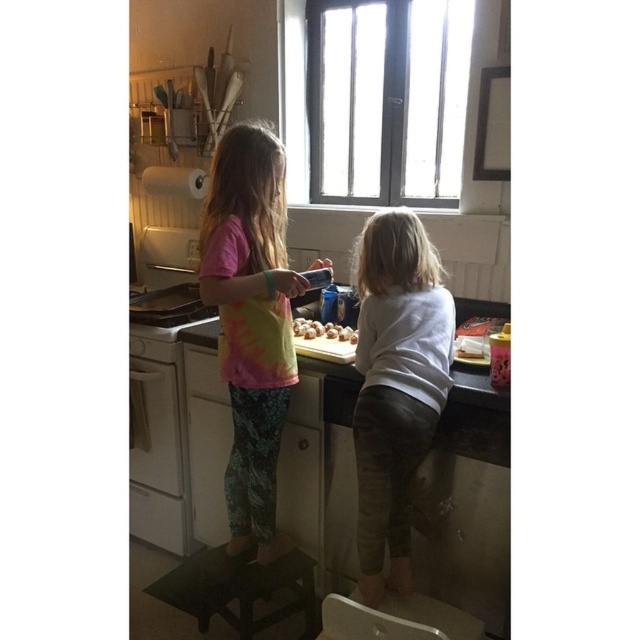
Can you confirm if tie-dye fabric shirt at center is wider than brown matte eggs at center?

Yes, tie-dye fabric shirt at center is wider than brown matte eggs at center.

Does tie-dye fabric shirt at center lie in front of brown matte eggs at center?

That is True.

Who is more distant from viewer, (241, 177) or (336, 323)?

The point (336, 323) is more distant.

Image resolution: width=640 pixels, height=640 pixels. What are the coordinates of `tie-dye fabric shirt at center` in the screenshot? It's located at (250, 321).

Is tie-dye fabric shirt at center further to the viewer compared to black wood step stool at lower center?

No, it is in front of black wood step stool at lower center.

You are a GUI agent. You are given a task and a screenshot of the screen. Output one action in this format:
    pyautogui.click(x=<x>, y=<y>)
    Task: Click on the tie-dye fabric shirt at center
    
    Given the screenshot: What is the action you would take?
    click(x=250, y=321)

Is white cotton shirt at right closer to the viewer compared to black wood step stool at lower center?

Yes, white cotton shirt at right is closer to the viewer.

Between white cotton shirt at right and black wood step stool at lower center, which one appears on the right side from the viewer's perspective?

white cotton shirt at right

This screenshot has height=640, width=640. What do you see at coordinates (396, 385) in the screenshot? I see `white cotton shirt at right` at bounding box center [396, 385].

This screenshot has height=640, width=640. Find the location of `white cotton shirt at right`. white cotton shirt at right is located at coordinates (396, 385).